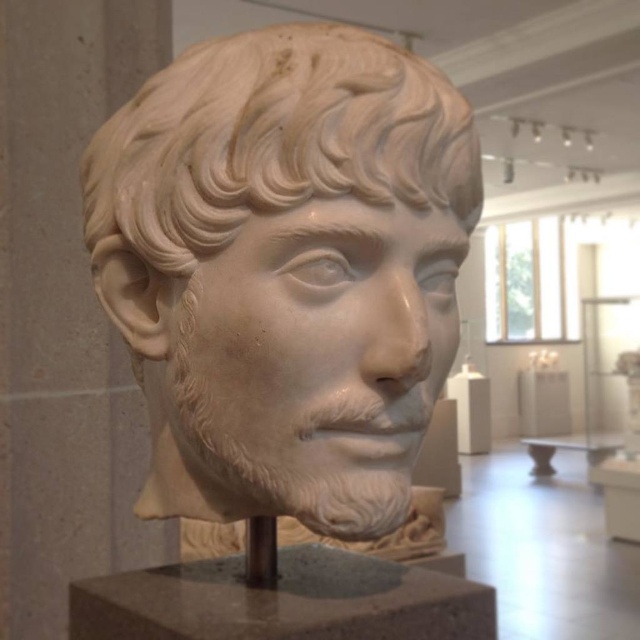
Question: Is white marble bust at center smaller than gray stone pedestal at center?

Choices:
 (A) yes
 (B) no

Answer: (B)

Question: Can you confirm if white marble bust at center is smaller than gray stone pedestal at center?

Choices:
 (A) no
 (B) yes

Answer: (A)

Question: Among these points, which one is nearest to the camera?

Choices:
 (A) (282, 250)
 (B) (403, 573)

Answer: (A)

Question: Which of the following is the farthest from the observer?

Choices:
 (A) (324, 368)
 (B) (70, 636)

Answer: (B)

Question: Does white marble bust at center appear on the right side of gray stone pedestal at center?

Choices:
 (A) yes
 (B) no

Answer: (B)

Question: Which point appears farthest from the camera in this image?

Choices:
 (A) (300, 339)
 (B) (196, 586)

Answer: (B)